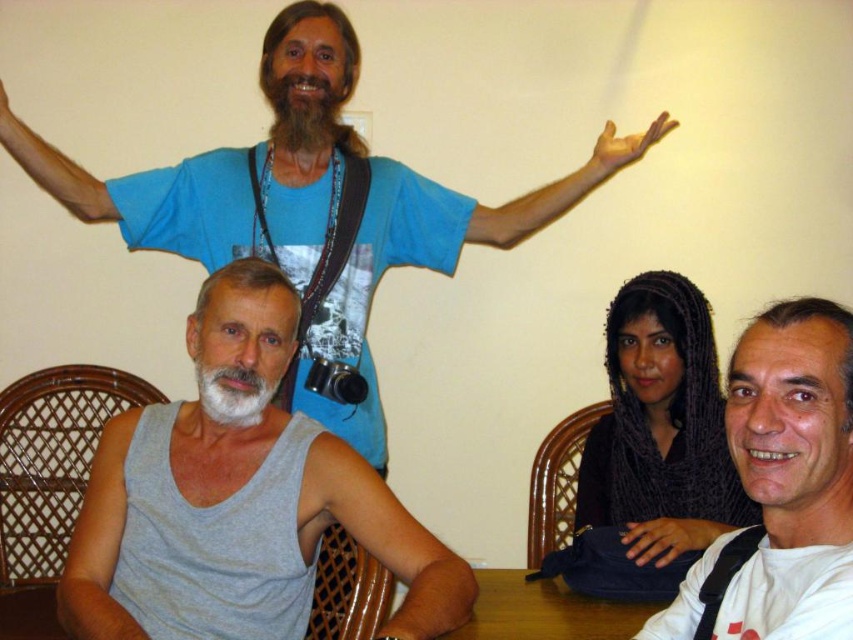
Question: Which object is positioned farthest from the blue matte arm at upper center?

Choices:
 (A) gray fabric sleeve at lower left
 (B) white matte shirt at lower right
 (C) white matte beard at lower left

Answer: (B)

Question: Which of the following is the farthest from the observer?

Choices:
 (A) (213, 298)
 (B) (677, 504)
 (C) (399, 579)
 (D) (289, 93)

Answer: (D)

Question: Is blue matte arm at upper center smaller than white matte beard at lower left?

Choices:
 (A) no
 (B) yes

Answer: (A)

Question: Which of these objects is positioned farthest from the white matte shirt at lower right?

Choices:
 (A) gray fabric sleeve at lower left
 (B) gray cotton tank top at center

Answer: (B)

Question: Considering the relative positions of dark gray knitted scarf at lower right and white matte beard at lower left in the image provided, where is dark gray knitted scarf at lower right located with respect to white matte beard at lower left?

Choices:
 (A) right
 (B) left

Answer: (A)

Question: Does gray fabric sleeve at lower left have a smaller size compared to blue matte arm at upper center?

Choices:
 (A) yes
 (B) no

Answer: (A)